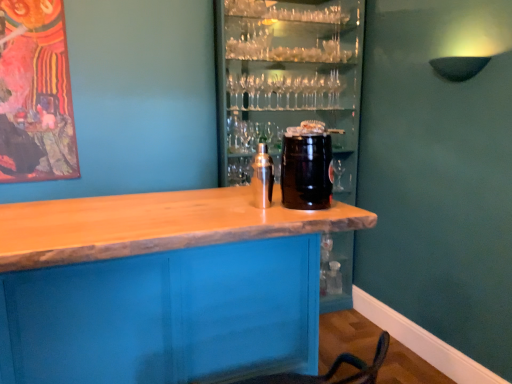
This screenshot has width=512, height=384. I want to click on free space in front of satin silver shaker at center, which ranks as the 2th beverage in right-to-left order, so click(261, 213).